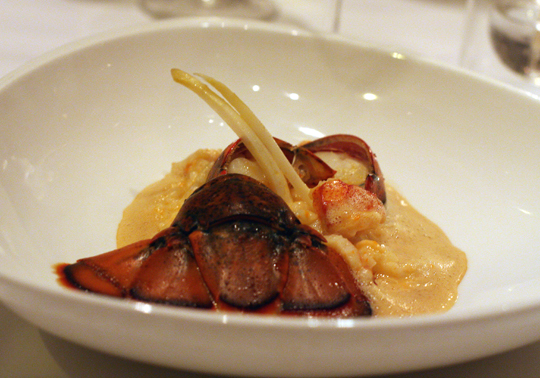
Where is `white ceramic dish`? white ceramic dish is located at coordinates (118, 157).